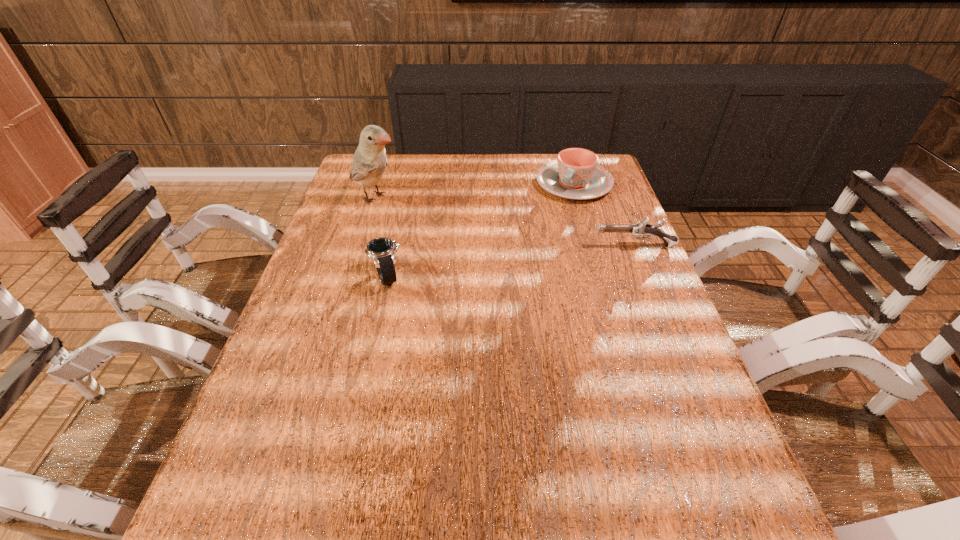
Find the location of a particular element. This screenshot has width=960, height=540. vacant space that is in between the gun and the chinaware is located at coordinates (604, 215).

Locate an element on the screen. vacant area that lies between the chinaware and the second nearest object is located at coordinates (604, 215).

Identify the location of empty space that is in between the chinaware and the third farthest object. (604, 215).

You are a GUI agent. You are given a task and a screenshot of the screen. Output one action in this format:
    pyautogui.click(x=<x>, y=<y>)
    Task: Click on the free space that is in between the second nearest object and the chinaware
    The height and width of the screenshot is (540, 960).
    Given the screenshot: What is the action you would take?
    pyautogui.click(x=604, y=215)

At what (x,y) coordinates should I click in order to perform the action: click on free area in between the gun and the chinaware. Please return your answer as a coordinate pair (x, y). Looking at the image, I should click on (604, 215).

Identify which object is the second nearest to the chinaware. Please provide its 2D coordinates. Your answer should be formatted as a tuple, i.e. [(x, y)], where the tuple contains the x and y coordinates of a point satisfying the conditions above.

[(369, 162)]

Locate which object is the third closest to the tallest object. Please provide its 2D coordinates. Your answer should be formatted as a tuple, i.e. [(x, y)], where the tuple contains the x and y coordinates of a point satisfying the conditions above.

[(641, 228)]

Where is `free space that satisfies the following two spatial constraints: 1. on the front side of the gun; 2. aimed along the barrel of the chinaware`? This screenshot has height=540, width=960. free space that satisfies the following two spatial constraints: 1. on the front side of the gun; 2. aimed along the barrel of the chinaware is located at coordinates (592, 246).

The width and height of the screenshot is (960, 540). I want to click on free space in the image that satisfies the following two spatial constraints: 1. on the back side of the chinaware; 2. on the left side of the bird, so click(x=380, y=184).

Locate an element on the screen. This screenshot has width=960, height=540. free point that satisfies the following two spatial constraints: 1. on the back side of the second nearest object; 2. aimed along the barrel of the watch is located at coordinates (394, 246).